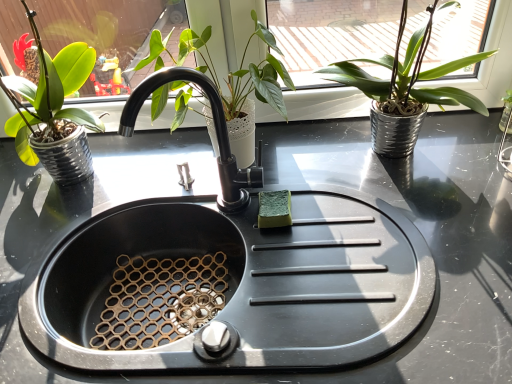
What is the approximate height of black matte faucet at center?

It is 13.92 inches.

This screenshot has height=384, width=512. Find the location of `black matte faucet at center`. black matte faucet at center is located at coordinates click(x=215, y=131).

This screenshot has height=384, width=512. What do you see at coordinates (404, 89) in the screenshot? I see `green matte plant at upper right, acting as the third houseplant starting from the left` at bounding box center [404, 89].

What is the approximate width of green matte plant at center, arranged as the second houseplant when viewed from the right?

green matte plant at center, arranged as the second houseplant when viewed from the right, is 11.11 inches wide.

In order to click on green matte plant pot at left, placed as the 3th houseplant when sorted from right to left in this screenshot , I will do `click(53, 112)`.

Considering the sizes of objects green matte plant pot at left, positioned as the first houseplant in left-to-right order, and black matte faucet at center in the image provided, who is shorter, green matte plant pot at left, positioned as the first houseplant in left-to-right order, or black matte faucet at center?

With less height is black matte faucet at center.

Locate an element on the screen. This screenshot has width=512, height=384. the 1st houseplant behind the black matte faucet at center, counting from the anchor's position is located at coordinates (53, 112).

Is green matte plant pot at left, positioned as the first houseplant in left-to-right order, aimed at black matte faucet at center?

No, green matte plant pot at left, positioned as the first houseplant in left-to-right order, is not turned towards black matte faucet at center.

Which object is more forward, green matte plant pot at left, positioned as the first houseplant in left-to-right order, or black matte faucet at center?

Positioned in front is black matte faucet at center.

Is black matte sink at center with black matte faucet at center?

No, black matte sink at center is not touching black matte faucet at center.

In the scene shown: Is black matte sink at center aimed at black matte faucet at center?

No.

Who is bigger, green matte plant at center, arranged as the second houseplant when viewed from the right, or black matte faucet at center?

With larger size is green matte plant at center, arranged as the second houseplant when viewed from the right.

Looking at this image, are green matte plant at center, arranged as the second houseplant when viewed from the right, and black matte faucet at center far apart?

No.

Considering the positions of point (173, 90) and point (159, 82), is point (173, 90) closer or farther from the camera than point (159, 82)?

Point (173, 90).

Considering the sizes of objects green matte plant at center, the 2th houseplant positioned from the left, and black matte faucet at center in the image provided, who is shorter, green matte plant at center, the 2th houseplant positioned from the left, or black matte faucet at center?

black matte faucet at center is shorter.

Could you tell me if black matte sink at center is turned towards green matte plant at center, arranged as the second houseplant when viewed from the right?

No, black matte sink at center is not turned towards green matte plant at center, arranged as the second houseplant when viewed from the right.

Would you say black matte sink at center is a long distance from green matte plant at center, arranged as the second houseplant when viewed from the right?

black matte sink at center is near green matte plant at center, arranged as the second houseplant when viewed from the right, not far away.

Where is `the 3rd houseplant behind the black matte sink at center`? This screenshot has height=384, width=512. the 3rd houseplant behind the black matte sink at center is located at coordinates (231, 81).

Is black matte sink at center further to the viewer compared to green matte plant at center, the 2th houseplant positioned from the left?

No, it is not.

Is green matte plant at upper right, acting as the third houseplant starting from the left, not within green matte plant at center, arranged as the second houseplant when viewed from the right?

green matte plant at upper right, acting as the third houseplant starting from the left, is positioned outside green matte plant at center, arranged as the second houseplant when viewed from the right.

Does green matte plant at upper right, marked as the first houseplant in a right-to-left arrangement, have a greater height compared to green matte plant at center, arranged as the second houseplant when viewed from the right?

Correct, green matte plant at upper right, marked as the first houseplant in a right-to-left arrangement, is much taller as green matte plant at center, arranged as the second houseplant when viewed from the right.

From a real-world perspective, is green matte plant at upper right, marked as the first houseplant in a right-to-left arrangement, beneath green matte plant at center, the 2th houseplant positioned from the left?

Actually, green matte plant at upper right, marked as the first houseplant in a right-to-left arrangement, is physically above green matte plant at center, the 2th houseplant positioned from the left, in the real world.

Considering the relative sizes of black matte faucet at center and black matte sink at center in the image provided, is black matte faucet at center bigger than black matte sink at center?

No.

Could you tell me if black matte faucet at center is turned towards black matte sink at center?

No, black matte faucet at center is not facing towards black matte sink at center.

In terms of width, does black matte faucet at center look wider or thinner when compared to black matte sink at center?

In the image, black matte faucet at center appears to be more narrow than black matte sink at center.

Is black matte faucet at center at the left side of black matte sink at center?

Indeed, black matte faucet at center is positioned on the left side of black matte sink at center.

Is green matte plant at upper right, acting as the third houseplant starting from the left, facing towards black matte sink at center?

No.

Does green matte plant at upper right, acting as the third houseplant starting from the left, touch black matte sink at center?

No, green matte plant at upper right, acting as the third houseplant starting from the left, is not next to black matte sink at center.

The width and height of the screenshot is (512, 384). In order to click on houseplant that is the 1st object located behind the black matte faucet at center in this screenshot , I will do `click(53, 112)`.

Identify the location of sink in front of the black matte faucet at center. (238, 272).

Estimate the real-world distances between objects in this image. Which object is further from black matte sink at center, black matte faucet at center or green matte plant at center, arranged as the second houseplant when viewed from the right?

green matte plant at center, arranged as the second houseplant when viewed from the right, is positioned further to the anchor black matte sink at center.

From the image, which object appears to be farther from green matte plant at upper right, acting as the third houseplant starting from the left, green matte plant at center, the 2th houseplant positioned from the left, or green matte plant pot at left, positioned as the first houseplant in left-to-right order?

green matte plant pot at left, positioned as the first houseplant in left-to-right order.

Based on their spatial positions, is black matte faucet at center or black matte sink at center closer to green matte plant at upper right, marked as the first houseplant in a right-to-left arrangement?

black matte faucet at center is closer to green matte plant at upper right, marked as the first houseplant in a right-to-left arrangement.

Which object lies nearer to the anchor point green matte plant at upper right, marked as the first houseplant in a right-to-left arrangement, green matte plant at center, the 2th houseplant positioned from the left, or black matte sink at center?

Among the two, green matte plant at center, the 2th houseplant positioned from the left, is located nearer to green matte plant at upper right, marked as the first houseplant in a right-to-left arrangement.

From the image, which object appears to be nearer to black matte sink at center, green matte plant pot at left, placed as the 3th houseplant when sorted from right to left, or green matte plant at upper right, acting as the third houseplant starting from the left?

green matte plant pot at left, placed as the 3th houseplant when sorted from right to left.

Which object lies further to the anchor point green matte plant at center, the 2th houseplant positioned from the left, green matte plant pot at left, placed as the 3th houseplant when sorted from right to left, or black matte faucet at center?

Among the two, green matte plant pot at left, placed as the 3th houseplant when sorted from right to left, is located further to green matte plant at center, the 2th houseplant positioned from the left.

Which object lies nearer to the anchor point black matte sink at center, black matte faucet at center or green matte plant pot at left, positioned as the first houseplant in left-to-right order?

Among the two, black matte faucet at center is located nearer to black matte sink at center.

Based on their spatial positions, is green matte plant at upper right, acting as the third houseplant starting from the left, or green matte plant pot at left, positioned as the first houseplant in left-to-right order, further from black matte faucet at center?

green matte plant pot at left, positioned as the first houseplant in left-to-right order, lies further to black matte faucet at center than the other object.

Where is `tap between green matte plant at center, arranged as the second houseplant when viewed from the right, and black matte sink at center in the up-down direction`? Image resolution: width=512 pixels, height=384 pixels. tap between green matte plant at center, arranged as the second houseplant when viewed from the right, and black matte sink at center in the up-down direction is located at coordinates point(215,131).

You are a GUI agent. You are given a task and a screenshot of the screen. Output one action in this format:
    pyautogui.click(x=<x>, y=<y>)
    Task: Click on the houseplant located between green matte plant pot at left, positioned as the first houseplant in left-to-right order, and green matte plant at upper right, marked as the first houseplant in a right-to-left arrangement, in the left-right direction
    This screenshot has width=512, height=384.
    Given the screenshot: What is the action you would take?
    pyautogui.click(x=231, y=81)

Find the location of a particular element. sink between green matte plant pot at left, positioned as the first houseplant in left-to-right order, and green matte plant at upper right, marked as the first houseplant in a right-to-left arrangement is located at coordinates (238, 272).

Locate an element on the screen. This screenshot has height=384, width=512. houseplant between green matte plant at center, the 2th houseplant positioned from the left, and black matte sink at center from top to bottom is located at coordinates (53, 112).